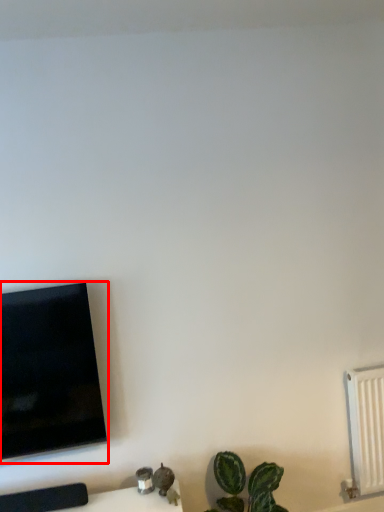
Question: From the image's perspective, considering the relative positions of television (annotated by the red box) and radiator in the image provided, where is television (annotated by the red box) located with respect to the staircase?

Choices:
 (A) above
 (B) below

Answer: (A)